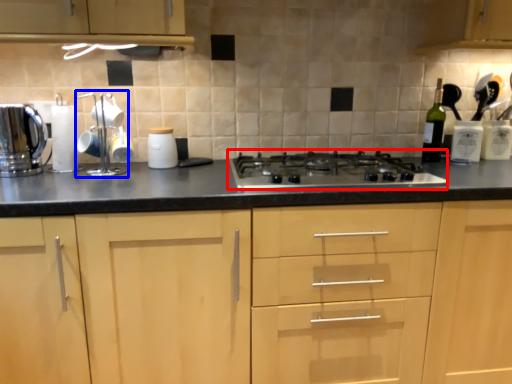
Question: Which of the following is the farthest to the observer, gas stove (highlighted by a red box) or appliance (highlighted by a blue box)?

Choices:
 (A) gas stove
 (B) appliance

Answer: (B)